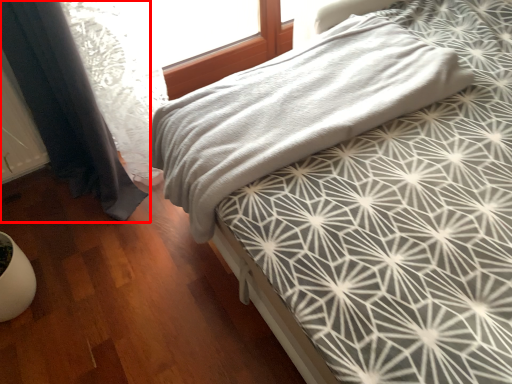
Question: From the image, what is the correct spatial relationship of curtain (annotated by the red box) in relation to bed?

Choices:
 (A) right
 (B) left

Answer: (B)